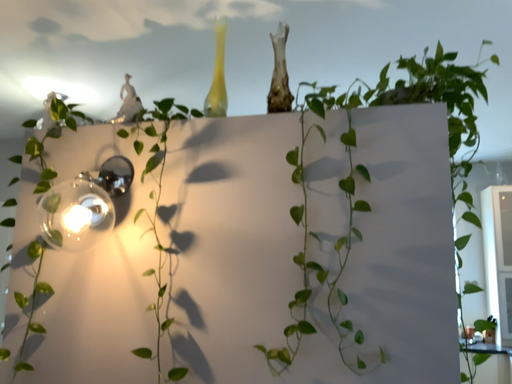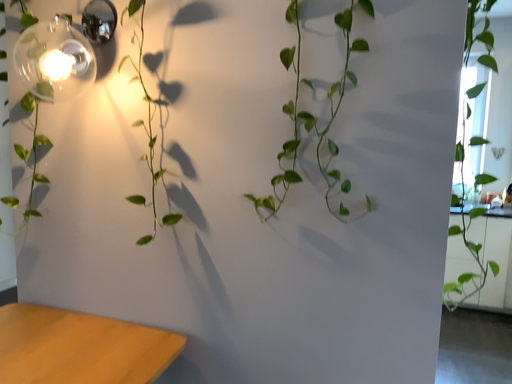
Question: Which way did the camera rotate in the video?

Choices:
 (A) rotated downward
 (B) rotated upward

Answer: (A)